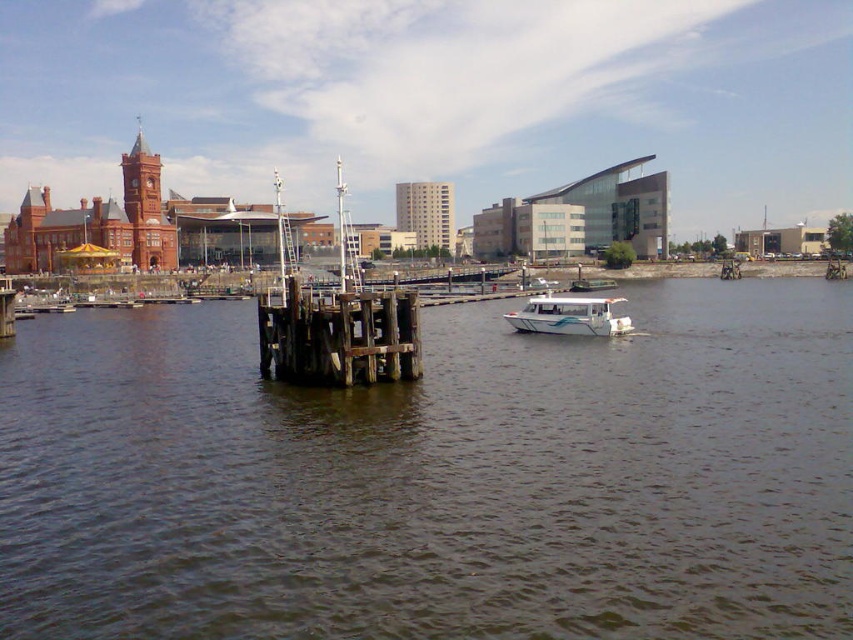
Is wooden at center closer to the viewer compared to white glossy boat at center?

Yes, wooden at center is in front of white glossy boat at center.

Can you confirm if wooden at center is positioned above white glossy boat at center?

No, wooden at center is not above white glossy boat at center.

This screenshot has width=853, height=640. I want to click on wooden at center, so click(x=339, y=337).

Between brown wooden dock at center and white glossy boat at center, which one has less height?

Standing shorter between the two is white glossy boat at center.

Who is more distant from viewer, (x=849, y=292) or (x=589, y=321)?

Point (x=849, y=292)

Identify the location of brown wooden dock at center. (436, 477).

Which of these two, brown wooden dock at center or wooden at center, stands shorter?

wooden at center is shorter.

Does brown wooden dock at center have a smaller size compared to wooden at center?

No, brown wooden dock at center is not smaller than wooden at center.

Locate an element on the screen. This screenshot has width=853, height=640. brown wooden dock at center is located at coordinates (436, 477).